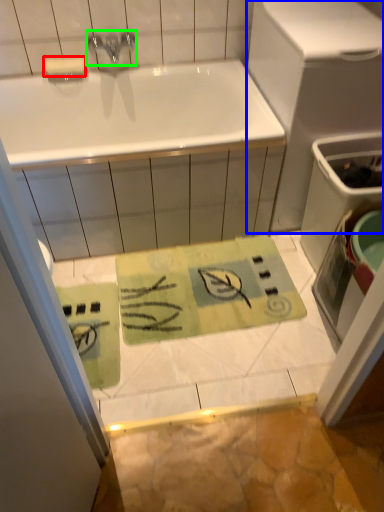
Question: Estimate the real-world distances between objects in this image. Which object is closer to soap (highlighted by a red box), appliance (highlighted by a blue box) or tap (highlighted by a green box)?

Choices:
 (A) appliance
 (B) tap

Answer: (B)